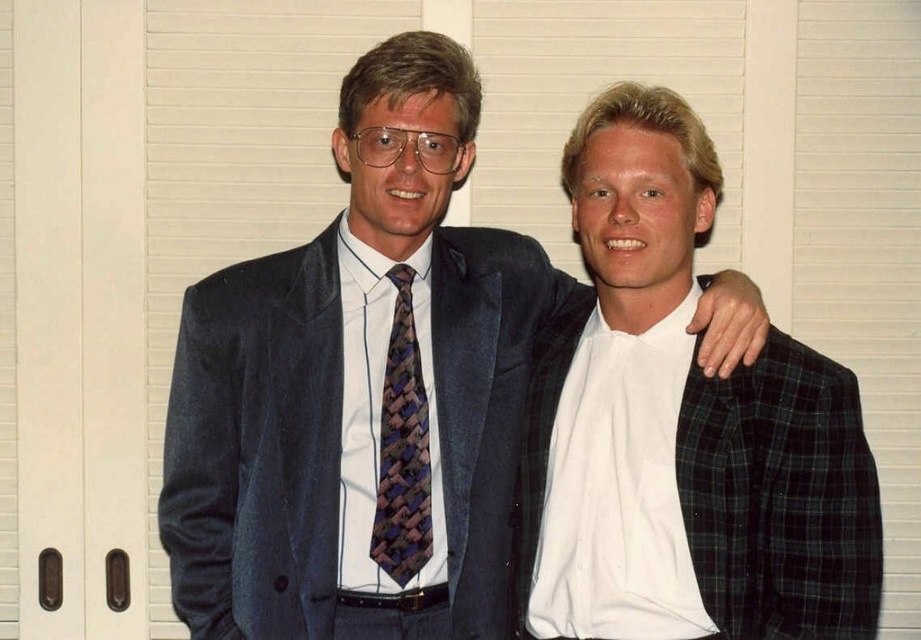
Question: Is satin blue suit at center smaller than woven silk tie at center?

Choices:
 (A) no
 (B) yes

Answer: (A)

Question: Is suede suit at center thinner than white cotton shirt at right?

Choices:
 (A) no
 (B) yes

Answer: (A)

Question: Which object appears closest to the camera in this image?

Choices:
 (A) woven silk tie at center
 (B) suede suit at center

Answer: (B)

Question: Which point is closer to the camera?

Choices:
 (A) satin blue suit at center
 (B) woven silk tie at center
 (C) suede suit at center
 (D) white cotton shirt at right

Answer: (D)

Question: Which point is farther from the camera taking this photo?

Choices:
 (A) (402, 580)
 (B) (367, 301)

Answer: (B)

Question: Can you confirm if satin blue suit at center is bigger than woven silk tie at center?

Choices:
 (A) yes
 (B) no

Answer: (A)